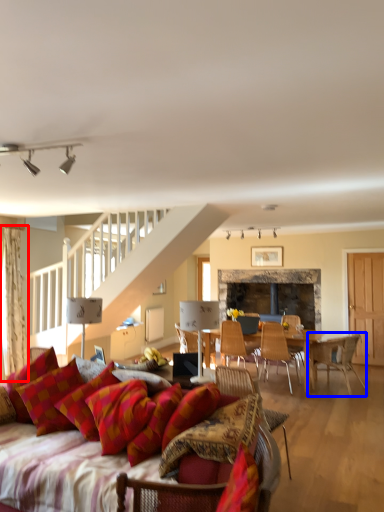
Question: Which object is closer to the camera taking this photo, curtain (highlighted by a red box) or chair (highlighted by a blue box)?

Choices:
 (A) curtain
 (B) chair

Answer: (A)